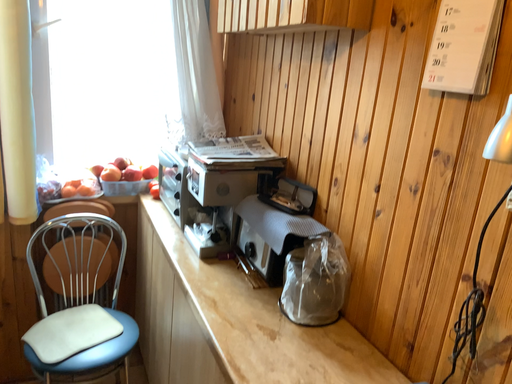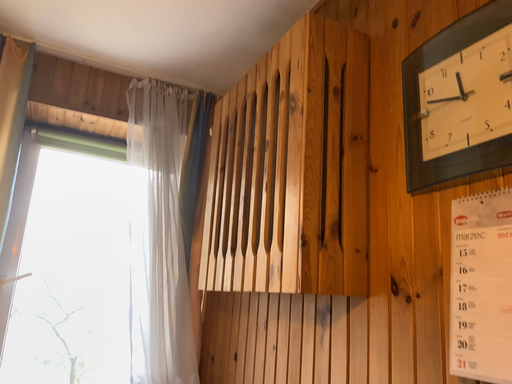
Question: Which way did the camera rotate in the video?

Choices:
 (A) rotated upward
 (B) rotated downward

Answer: (A)